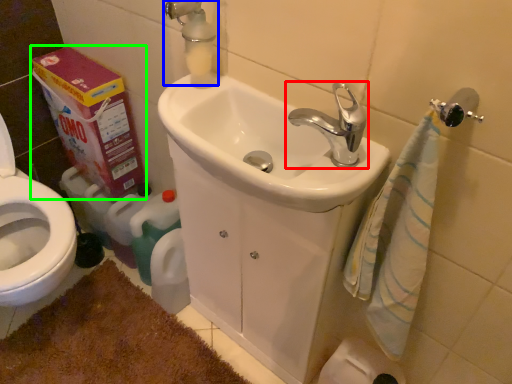
Question: Considering the real-world distances, which object is farthest from tap (highlighted by a red box)? plumbing fixture (highlighted by a blue box) or carton (highlighted by a green box)?

Choices:
 (A) plumbing fixture
 (B) carton

Answer: (B)